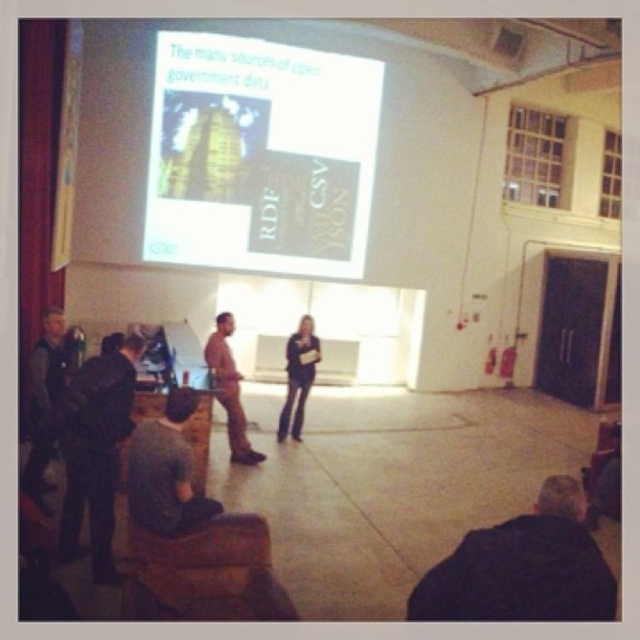
You are organizing a photoshoot and need to ensure that the gray fabric shirt at lower left and the matte black pants at center are both visible in the frame. Based on their positions and possible sizes, could there be an issue with one of them being too wide for the camera angle?

The gray fabric shirt at lower left might be wider than matte black pants at center, so there could be a risk that the gray fabric shirt at lower left is too wide for the camera angle and may not fit entirely within the frame.

You are an event coordinator checking the seating arrangement for the presentation. You notice the gray fabric shirt at lower left and the matte black pants at center. Which of these two is positioned to the left?

The gray fabric shirt at lower left is positioned to the left of the matte black pants at center.